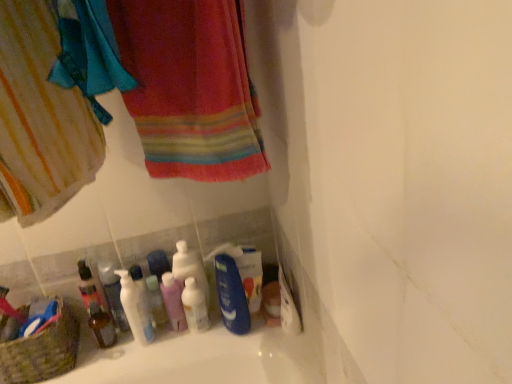
What are the coordinates of `white glossy bottle at center, the second cleaning product when ordered from left to right` in the screenshot? It's located at (190, 268).

The height and width of the screenshot is (384, 512). Find the location of `blue matte bottle at center, the first cleaning product viewed from the right`. blue matte bottle at center, the first cleaning product viewed from the right is located at coordinates (231, 295).

In order to face multicolored woven towel at upper left, should I rotate leftwards or rightwards?

Rotate left and turn 10.071 degrees.

Find the location of a particular element. This screenshot has width=512, height=384. white glossy mouthwash at center, arranged as the first mouthwash when viewed from the right is located at coordinates (195, 306).

This screenshot has height=384, width=512. Describe the element at coordinates (173, 301) in the screenshot. I see `pink plastic mouthwash at center, the 3th mouthwash from the left` at that location.

This screenshot has height=384, width=512. What do you see at coordinates (101, 326) in the screenshot?
I see `translucent plastic mouthwash at lower left, positioned as the 1th mouthwash in left-to-right order` at bounding box center [101, 326].

Where is `striped cotton towel at upper left`? striped cotton towel at upper left is located at coordinates (40, 120).

Is translucent plastic mouthwash at lower left, the 4th mouthwash in the right-to-left sequence, to the left of white glossy mouthwash at center, which appears as the fourth mouthwash when viewed from the left, from the viewer's perspective?

Yes, translucent plastic mouthwash at lower left, the 4th mouthwash in the right-to-left sequence, is to the left of white glossy mouthwash at center, which appears as the fourth mouthwash when viewed from the left.

Who is taller, translucent plastic mouthwash at lower left, the 4th mouthwash in the right-to-left sequence, or white glossy mouthwash at center, arranged as the first mouthwash when viewed from the right?

white glossy mouthwash at center, arranged as the first mouthwash when viewed from the right, is taller.

Is translucent plastic mouthwash at lower left, positioned as the 1th mouthwash in left-to-right order, bigger or smaller than white glossy mouthwash at center, which appears as the fourth mouthwash when viewed from the left?

In the image, translucent plastic mouthwash at lower left, positioned as the 1th mouthwash in left-to-right order, appears to be smaller than white glossy mouthwash at center, which appears as the fourth mouthwash when viewed from the left.

Is translucent plastic mouthwash at lower left, the 4th mouthwash in the right-to-left sequence, turned away from white glossy mouthwash at center, which appears as the fourth mouthwash when viewed from the left?

No, translucent plastic mouthwash at lower left, the 4th mouthwash in the right-to-left sequence, is not facing away from white glossy mouthwash at center, which appears as the fourth mouthwash when viewed from the left.

Locate an element on the screen. The image size is (512, 384). curtain on the left of blue matte bottle at center, the third cleaning product when ordered from left to right is located at coordinates (40, 120).

Is blue matte bottle at center, the first cleaning product viewed from the right, facing towards striped cotton towel at upper left?

No.

Based on their positions, is blue matte bottle at center, the first cleaning product viewed from the right, located to the left or right of striped cotton towel at upper left?

blue matte bottle at center, the first cleaning product viewed from the right, is to the right of striped cotton towel at upper left.

Identify the location of the 3rd cleaning product below the multicolored woven towel at upper left (from the image's perspective). (135, 308).

Looking at this image, is multicolored woven towel at upper left in front of or behind white glossy pump bottle at lower left, marked as the 1th cleaning product in a left-to-right arrangement, in the image?

multicolored woven towel at upper left is positioned closer to the viewer than white glossy pump bottle at lower left, marked as the 1th cleaning product in a left-to-right arrangement.

Is multicolored woven towel at upper left positioned beyond the bounds of white glossy pump bottle at lower left, positioned as the 3th cleaning product in right-to-left order?

That's correct, multicolored woven towel at upper left is outside of white glossy pump bottle at lower left, positioned as the 3th cleaning product in right-to-left order.

From the image's perspective, between multicolored woven towel at upper left and white glossy pump bottle at lower left, marked as the 1th cleaning product in a left-to-right arrangement, who is located below?

white glossy pump bottle at lower left, marked as the 1th cleaning product in a left-to-right arrangement, is shown below in the image.

Is blue matte bottle at center, the third cleaning product when ordered from left to right, at the right side of white glossy mouthwash at center, which appears as the fourth mouthwash when viewed from the left?

Yes.

Who is shorter, blue matte bottle at center, the first cleaning product viewed from the right, or white glossy mouthwash at center, which appears as the fourth mouthwash when viewed from the left?

With less height is white glossy mouthwash at center, which appears as the fourth mouthwash when viewed from the left.

Considering the relative sizes of blue matte bottle at center, the third cleaning product when ordered from left to right, and white glossy mouthwash at center, which appears as the fourth mouthwash when viewed from the left, in the image provided, is blue matte bottle at center, the third cleaning product when ordered from left to right, smaller than white glossy mouthwash at center, which appears as the fourth mouthwash when viewed from the left,?

Actually, blue matte bottle at center, the third cleaning product when ordered from left to right, might be larger than white glossy mouthwash at center, which appears as the fourth mouthwash when viewed from the left.

Is point (127, 276) farther from viewer compared to point (190, 317)?

No, it is not.

How many degrees apart are the facing directions of white glossy pump bottle at lower left, marked as the 1th cleaning product in a left-to-right arrangement, and white glossy mouthwash at center, arranged as the first mouthwash when viewed from the right?

0.00393 degrees.

Is white glossy pump bottle at lower left, positioned as the 3th cleaning product in right-to-left order, bigger than white glossy mouthwash at center, arranged as the first mouthwash when viewed from the right?

Indeed, white glossy pump bottle at lower left, positioned as the 3th cleaning product in right-to-left order, has a larger size compared to white glossy mouthwash at center, arranged as the first mouthwash when viewed from the right.

Is white glossy pump bottle at lower left, marked as the 1th cleaning product in a left-to-right arrangement, positioned beyond the bounds of white glossy mouthwash at center, arranged as the first mouthwash when viewed from the right?

Yes, white glossy pump bottle at lower left, marked as the 1th cleaning product in a left-to-right arrangement, is not within white glossy mouthwash at center, arranged as the first mouthwash when viewed from the right.

From the image's perspective, who appears lower, white glossy mouthwash at center, arranged as the first mouthwash when viewed from the right, or white glossy mouthwash at lower left, positioned as the 2th mouthwash in left-to-right order?

white glossy mouthwash at center, arranged as the first mouthwash when viewed from the right, is shown below in the image.

Does white glossy mouthwash at center, which appears as the fourth mouthwash when viewed from the left, have a greater height compared to white glossy mouthwash at lower left, positioned as the 2th mouthwash in left-to-right order?

No, white glossy mouthwash at center, which appears as the fourth mouthwash when viewed from the left, is not taller than white glossy mouthwash at lower left, positioned as the 2th mouthwash in left-to-right order.

Based on their positions, is white glossy mouthwash at center, arranged as the first mouthwash when viewed from the right, located to the left or right of white glossy mouthwash at lower left, acting as the 3th mouthwash starting from the right?

From the image, it's evident that white glossy mouthwash at center, arranged as the first mouthwash when viewed from the right, is to the right of white glossy mouthwash at lower left, acting as the 3th mouthwash starting from the right.

Measure the distance between white glossy mouthwash at center, which appears as the fourth mouthwash when viewed from the left, and white glossy mouthwash at lower left, positioned as the 2th mouthwash in left-to-right order.

7.46 inches.

Is striped cotton towel at upper left bigger than white glossy mouthwash at center, which appears as the fourth mouthwash when viewed from the left?

Indeed, striped cotton towel at upper left has a larger size compared to white glossy mouthwash at center, which appears as the fourth mouthwash when viewed from the left.

From a real-world perspective, is striped cotton towel at upper left positioned over white glossy mouthwash at center, arranged as the first mouthwash when viewed from the right, based on gravity?

Yes, from a real-world perspective, striped cotton towel at upper left is over white glossy mouthwash at center, arranged as the first mouthwash when viewed from the right

From the image's perspective, is striped cotton towel at upper left on top of white glossy mouthwash at center, which appears as the fourth mouthwash when viewed from the left?

Yes, from the image's perspective, striped cotton towel at upper left is over white glossy mouthwash at center, which appears as the fourth mouthwash when viewed from the left.

The width and height of the screenshot is (512, 384). I want to click on curtain located on the left of white glossy mouthwash at center, arranged as the first mouthwash when viewed from the right, so click(x=40, y=120).

The width and height of the screenshot is (512, 384). There is a translucent plastic mouthwash at lower left, positioned as the 1th mouthwash in left-to-right order. Find the location of `the 2nd mouthwash above it (from the image's perspective)`. the 2nd mouthwash above it (from the image's perspective) is located at coordinates (195, 306).

Identify the location of the 2nd cleaning product counting from the right side of the striped cotton towel at upper left. (231, 295).

Looking at this image, from the image, which object appears to be farther from white glossy mouthwash at center, arranged as the first mouthwash when viewed from the right, striped cotton towel at upper left or blue matte bottle at center, the third cleaning product when ordered from left to right?

striped cotton towel at upper left lies further to white glossy mouthwash at center, arranged as the first mouthwash when viewed from the right, than the other object.

Considering their positions, is multicolored woven towel at upper left positioned closer to white glossy mouthwash at center, which appears as the fourth mouthwash when viewed from the left, than textured wicker basket at lower left?

textured wicker basket at lower left is positioned closer to the anchor white glossy mouthwash at center, which appears as the fourth mouthwash when viewed from the left.

When comparing their distances from white glossy mouthwash at lower left, acting as the 3th mouthwash starting from the right, does multicolored woven towel at upper left or white glossy mouthwash at center, arranged as the first mouthwash when viewed from the right, seem closer?

white glossy mouthwash at center, arranged as the first mouthwash when viewed from the right.

Looking at the image, which one is located closer to pink plastic mouthwash at center, positioned as the second mouthwash in right-to-left order, white glossy mouthwash at center, which appears as the fourth mouthwash when viewed from the left, or white glossy mouthwash at lower left, positioned as the 2th mouthwash in left-to-right order?

Based on the image, white glossy mouthwash at center, which appears as the fourth mouthwash when viewed from the left, appears to be nearer to pink plastic mouthwash at center, positioned as the second mouthwash in right-to-left order.

Based on their spatial positions, is blue matte bottle at center, the third cleaning product when ordered from left to right, or textured wicker basket at lower left further from white glossy pump bottle at lower left, marked as the 1th cleaning product in a left-to-right arrangement?

blue matte bottle at center, the third cleaning product when ordered from left to right, is positioned further to the anchor white glossy pump bottle at lower left, marked as the 1th cleaning product in a left-to-right arrangement.

Estimate the real-world distances between objects in this image. Which object is further from white glossy pump bottle at lower left, positioned as the 3th cleaning product in right-to-left order, white glossy bottle at center, which appears as the 2th cleaning product when viewed from the right, or white glossy mouthwash at center, arranged as the first mouthwash when viewed from the right?

white glossy bottle at center, which appears as the 2th cleaning product when viewed from the right.

Based on their spatial positions, is white glossy bottle at center, the second cleaning product when ordered from left to right, or translucent plastic mouthwash at lower left, the 4th mouthwash in the right-to-left sequence, closer to textured wicker basket at lower left?

translucent plastic mouthwash at lower left, the 4th mouthwash in the right-to-left sequence.

Which object lies further to the anchor point textured wicker basket at lower left, striped cotton towel at upper left or pink plastic mouthwash at center, the 3th mouthwash from the left?

Based on the image, striped cotton towel at upper left appears to be further to textured wicker basket at lower left.

Identify the location of cleaning product situated between textured wicker basket at lower left and white glossy bottle at center, the second cleaning product when ordered from left to right, from left to right. Image resolution: width=512 pixels, height=384 pixels. (135, 308).

Image resolution: width=512 pixels, height=384 pixels. Identify the location of laundry positioned between striped cotton towel at upper left and white glossy bottle at center, which appears as the 2th cleaning product when viewed from the right, from near to far. (40, 120).

The height and width of the screenshot is (384, 512). What are the coordinates of `laundry between striped cotton towel at upper left and pink plastic mouthwash at center, the 3th mouthwash from the left, in the front-back direction` in the screenshot? It's located at (40, 120).

What are the coordinates of `mouthwash between white glossy bottle at center, which appears as the 2th cleaning product when viewed from the right, and blue matte bottle at center, the third cleaning product when ordered from left to right` in the screenshot? It's located at (195, 306).